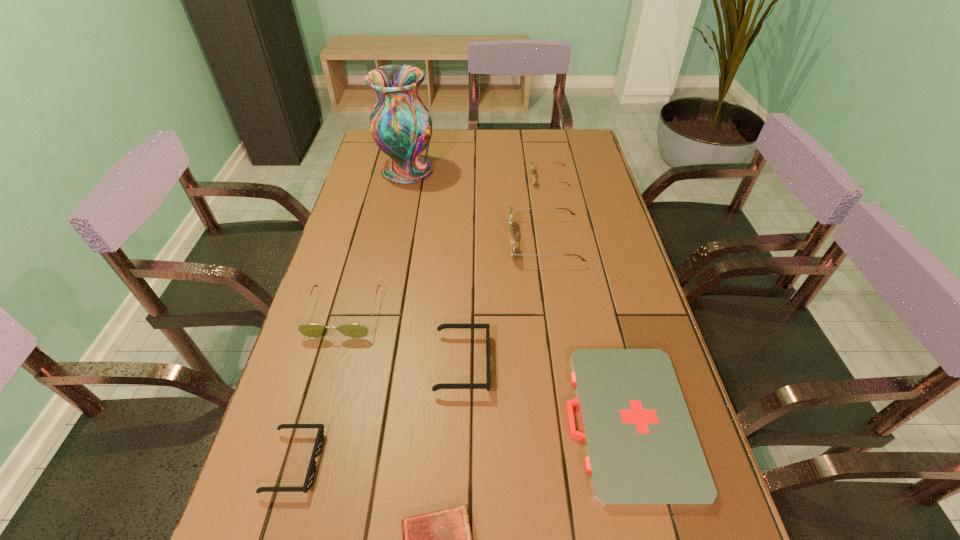
Find the location of a particular element. Image resolution: width=960 pixels, height=540 pixels. free location at the left edge of the desktop is located at coordinates pos(389,227).

This screenshot has width=960, height=540. I want to click on vacant area at the right edge, so 622,250.

This screenshot has width=960, height=540. Identify the location of free spot at the far left corner of the desktop. (382, 153).

Image resolution: width=960 pixels, height=540 pixels. In the image, there is a desktop. Find the location of `vacant region at the far right corner`. vacant region at the far right corner is located at coordinates (594, 160).

Where is `free space between the bigger black sunglasses and the first-aid kit`? The width and height of the screenshot is (960, 540). free space between the bigger black sunglasses and the first-aid kit is located at coordinates (545, 392).

The height and width of the screenshot is (540, 960). Identify the location of unoccupied position between the first-aid kit and the second biggest green sunglasses. (486, 367).

Where is `free space between the tallest object and the sixth tallest object`? Image resolution: width=960 pixels, height=540 pixels. free space between the tallest object and the sixth tallest object is located at coordinates (351, 316).

Identify the location of vacant region between the nearest sunglasses and the right black sunglasses. (378, 413).

Locate an element on the screen. Image resolution: width=960 pixels, height=540 pixels. vacant space that is in between the bigger black sunglasses and the nearest green sunglasses is located at coordinates (403, 338).

Locate an element on the screen. This screenshot has width=960, height=540. vacant area that lies between the smaller black sunglasses and the biggest green sunglasses is located at coordinates (420, 352).